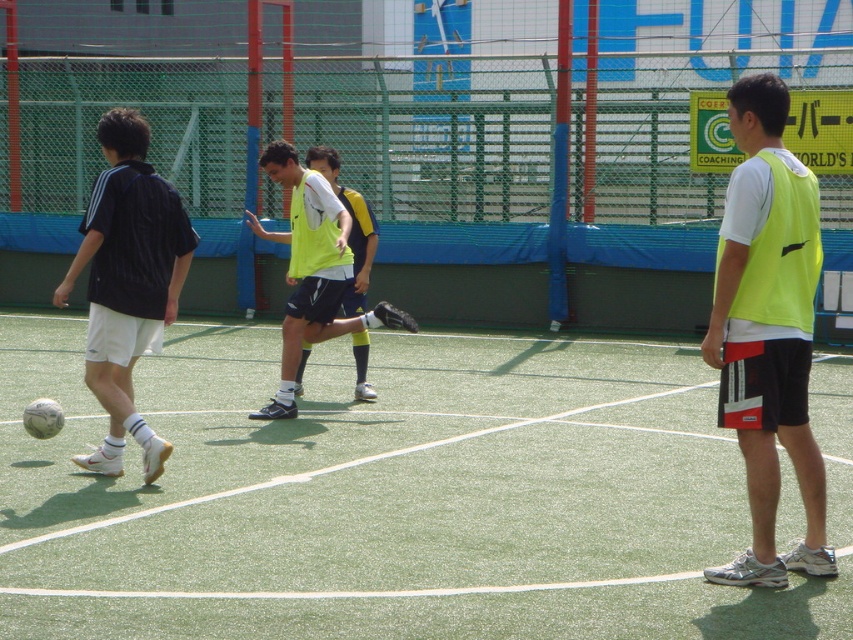
Question: Considering the real-world distances, which object is farthest from the black matte shirt at left?

Choices:
 (A) green artificial turf at center
 (B) neon yellow vest at right
 (C) neon yellow jersey at center

Answer: (B)

Question: Is green artificial turf at center positioned before neon yellow jersey at center?

Choices:
 (A) yes
 (B) no

Answer: (A)

Question: Does neon yellow vest at right have a lesser width compared to neon yellow jersey at center?

Choices:
 (A) no
 (B) yes

Answer: (B)

Question: Which point is closer to the camera taking this photo?

Choices:
 (A) (167, 268)
 (B) (769, 337)

Answer: (B)

Question: Based on their relative distances, which object is farther from the neon yellow vest at right?

Choices:
 (A) black matte shirt at left
 (B) neon yellow jersey at center

Answer: (B)

Question: Is neon yellow vest at right further to camera compared to black matte shirt at left?

Choices:
 (A) yes
 (B) no

Answer: (B)